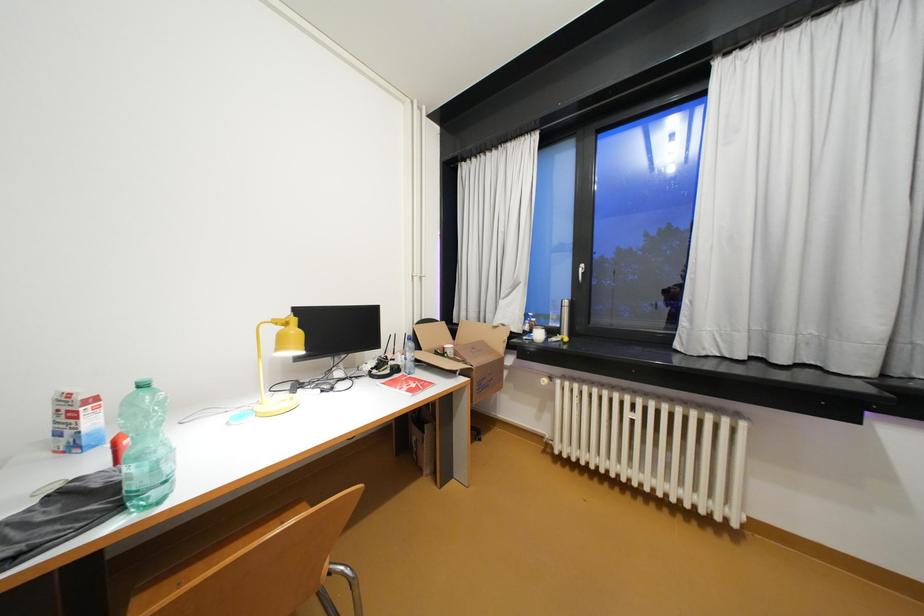
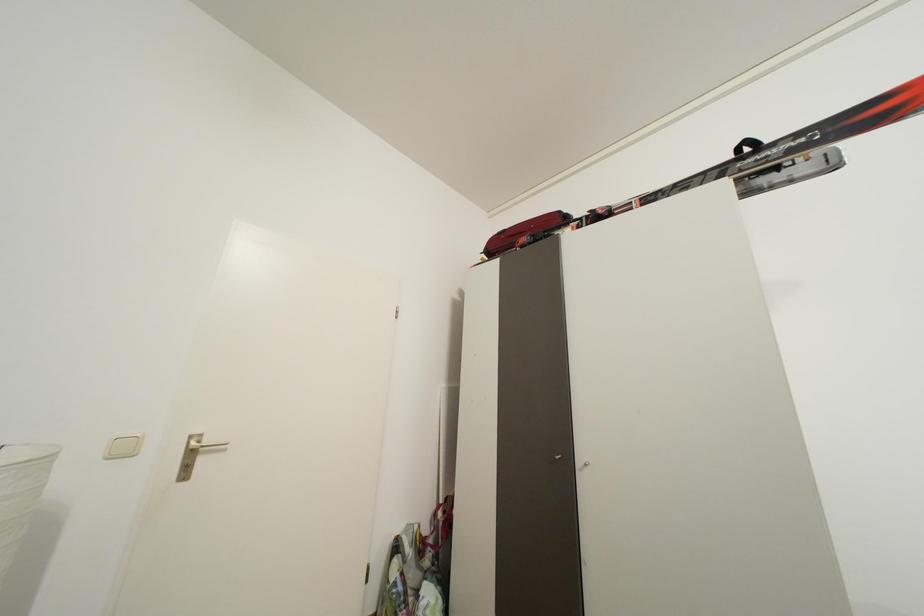
Question: The camera is either moving clockwise (left) or counter-clockwise (right) around the object. The first image is from the beginning of the video and the second image is from the end. Is the camera moving left or right when shooting the video?

Choices:
 (A) Left
 (B) Right

Answer: (B)